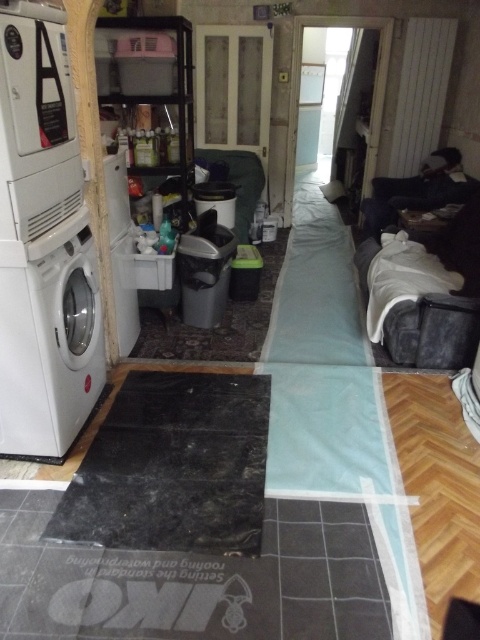
Who is shorter, white glossy washing machine at left or velvet grey sofa at right?

With less height is velvet grey sofa at right.

Can you confirm if white glossy washing machine at left is shorter than velvet grey sofa at right?

No.

Locate an element on the screen. The image size is (480, 640). white glossy washing machine at left is located at coordinates (48, 340).

The width and height of the screenshot is (480, 640). In order to click on white glossy washing machine at left in this screenshot , I will do 48,340.